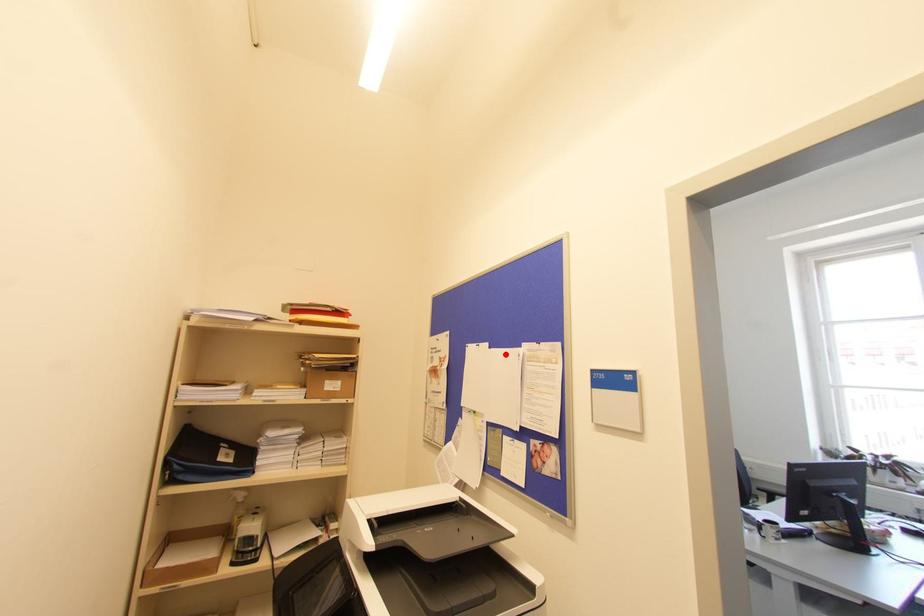
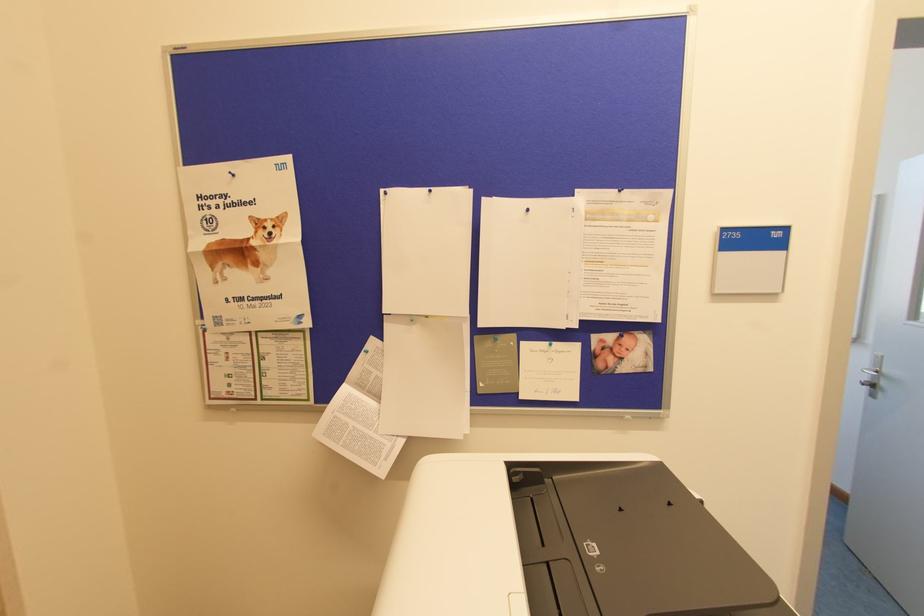
Find the pixel in the second image that matches the highlighted location in the first image.

(527, 209)